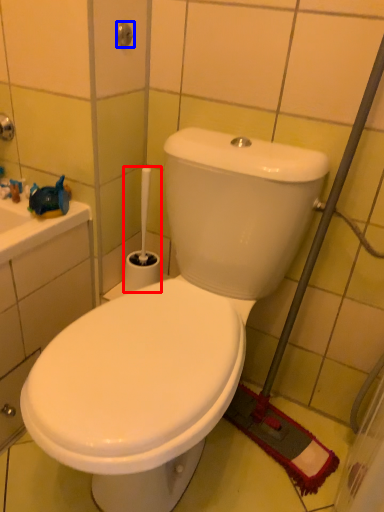
Question: Which point is further to the camera, brush (highlighted by a red box) or shower (highlighted by a blue box)?

Choices:
 (A) brush
 (B) shower

Answer: (A)